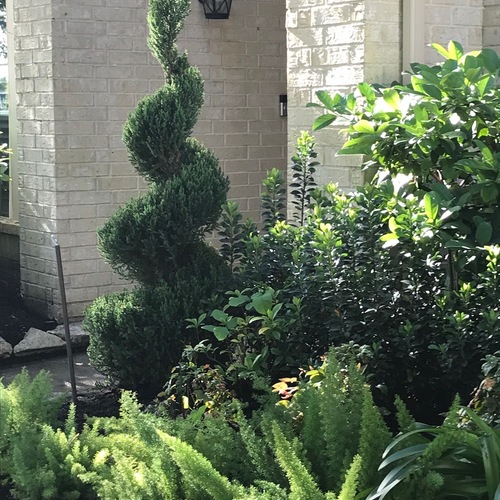
Identify the location of walk way. (59, 378).